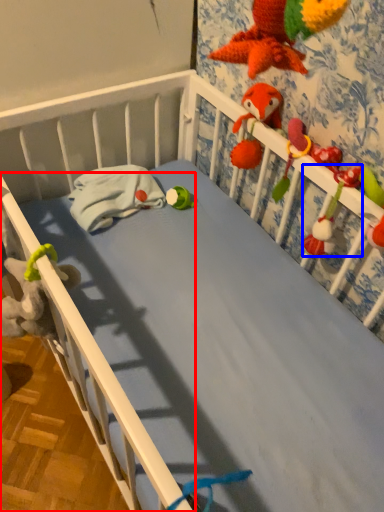
Question: Which object is further to the camera taking this photo, rail (highlighted by a red box) or toy (highlighted by a blue box)?

Choices:
 (A) rail
 (B) toy

Answer: (A)